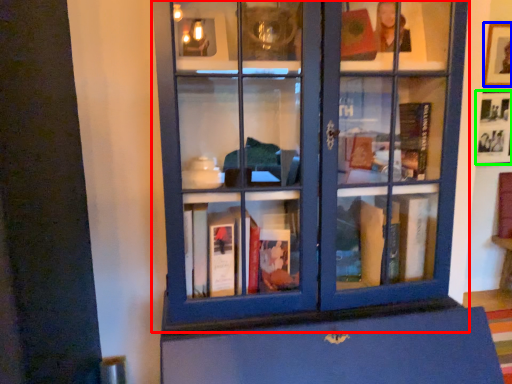
Question: Estimate the real-world distances between objects in this image. Which object is farther from bookcase (highlighted by a red box), picture frame (highlighted by a blue box) or picture frame (highlighted by a green box)?

Choices:
 (A) picture frame
 (B) picture frame

Answer: (A)